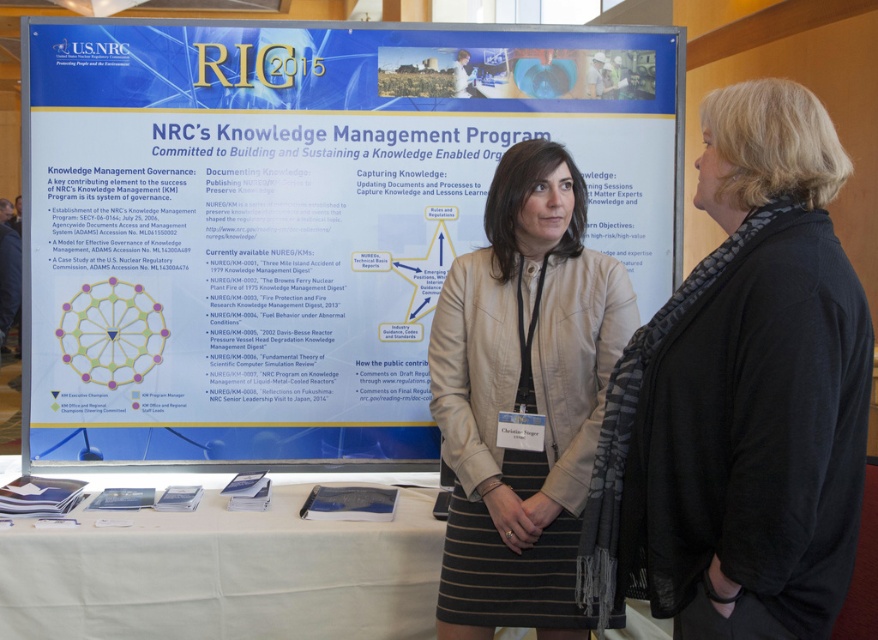
Question: Can you confirm if white paperboard poster at center is positioned below beige leather jacket at center?

Choices:
 (A) no
 (B) yes

Answer: (A)

Question: Which point is closer to the camera?

Choices:
 (A) beige leather jacket at center
 (B) white paperboard poster at center

Answer: (A)

Question: Which point is closer to the camera?

Choices:
 (A) (733, 365)
 (B) (184, 534)
 (C) (509, 476)
 (D) (450, 58)

Answer: (A)

Question: Among these points, which one is farthest from the camera?

Choices:
 (A) (362, 196)
 (B) (306, 490)
 (C) (494, 534)

Answer: (A)

Question: Is black scarf at right smaller than beige leather jacket at center?

Choices:
 (A) yes
 (B) no

Answer: (B)

Question: Can you confirm if black scarf at right is thinner than beige leather jacket at center?

Choices:
 (A) yes
 (B) no

Answer: (A)